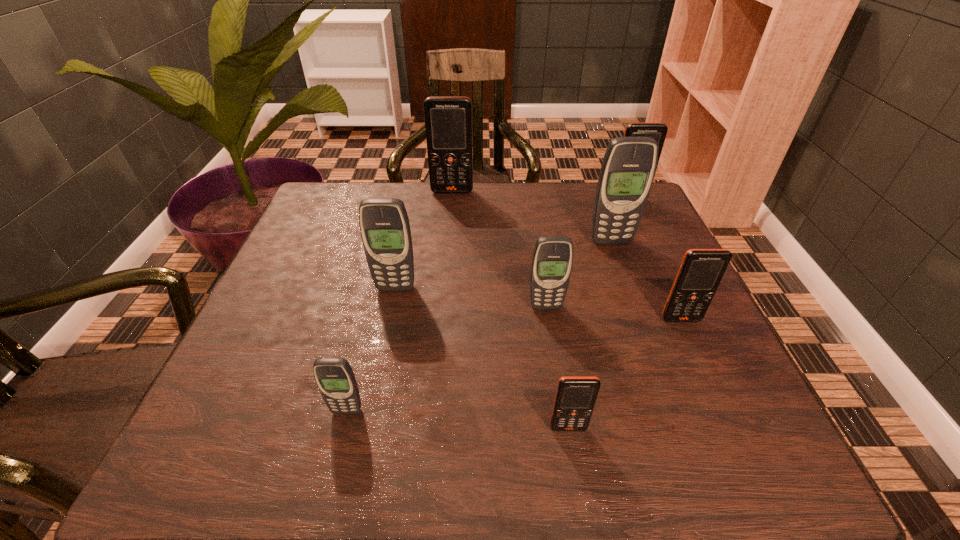
Where is `the sixth farthest cellular telephone`? Image resolution: width=960 pixels, height=540 pixels. the sixth farthest cellular telephone is located at coordinates (701, 271).

Image resolution: width=960 pixels, height=540 pixels. Find the location of `the third biggest orange cellular telephone`. the third biggest orange cellular telephone is located at coordinates (701, 271).

Where is `the nearest orange cellular telephone`? The height and width of the screenshot is (540, 960). the nearest orange cellular telephone is located at coordinates (575, 398).

Locate an element on the screen. the nearest cellular telephone is located at coordinates (575, 398).

What are the coordinates of `the second nearest object` in the screenshot? It's located at coord(335,378).

You are a GUI agent. You are given a task and a screenshot of the screen. Output one action in this format:
    pyautogui.click(x=<x>, y=<y>)
    Task: Click on the second nearest cellular telephone
    The image size is (960, 540).
    Given the screenshot: What is the action you would take?
    pyautogui.click(x=335, y=378)

You are a GUI agent. You are given a task and a screenshot of the screen. Output one action in this format:
    pyautogui.click(x=<x>, y=<y>)
    Task: Click on the free region located on the screen of the farthest orange cellular telephone
    
    Given the screenshot: What is the action you would take?
    pyautogui.click(x=447, y=241)

The width and height of the screenshot is (960, 540). I want to click on vacant space situated on the screen of the rightmost gray cellular telephone, so click(633, 303).

In order to click on free space located on the screen of the third nearest orange cellular telephone in this screenshot , I will do `click(659, 268)`.

Where is `blank area located 0.240m on the screen of the fourth farthest object`? This screenshot has height=540, width=960. blank area located 0.240m on the screen of the fourth farthest object is located at coordinates (375, 386).